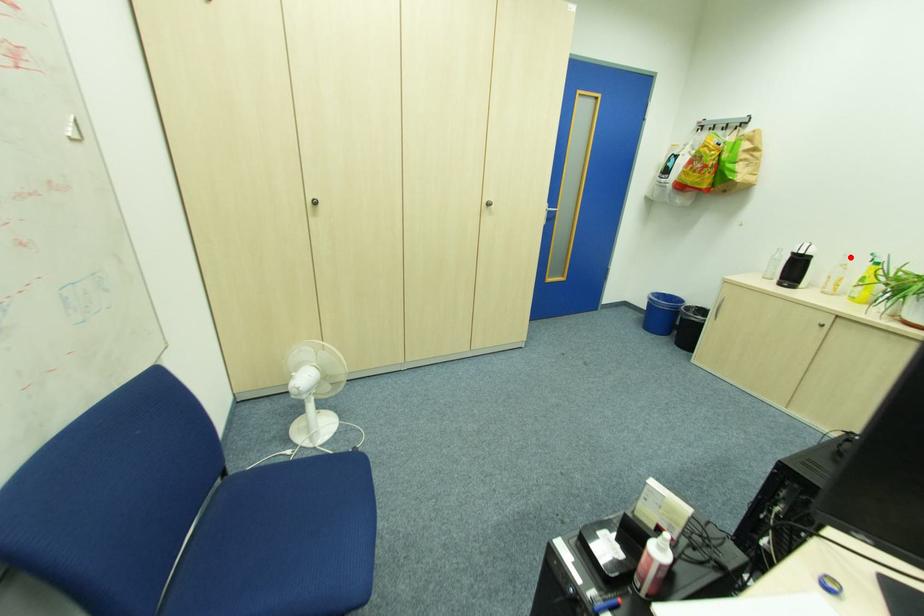
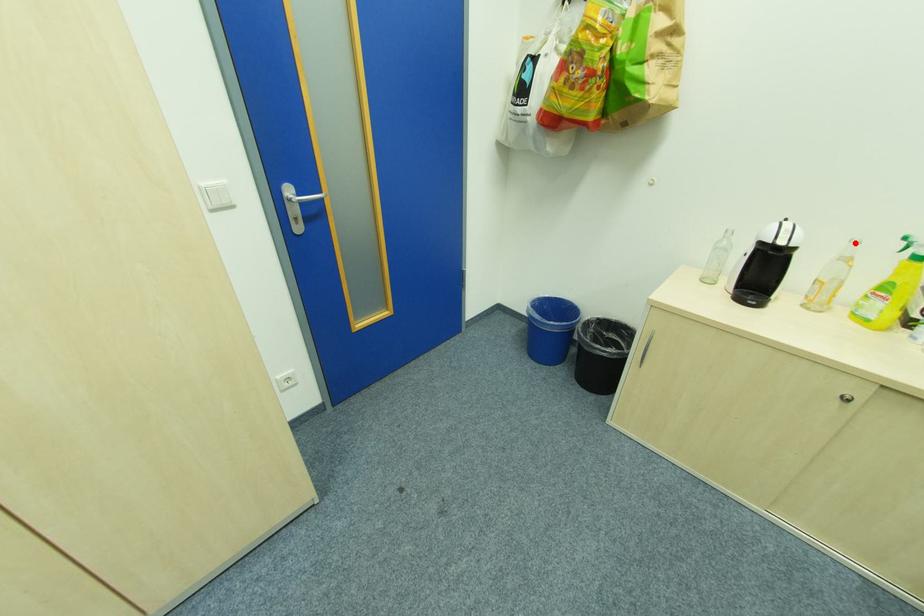
I am providing you with two images of the same scene from different viewpoints. A red point is marked on the first image and another point is marked on the second image. Does the point marked in image1 correspond to the same location as the one in image2?

Yes